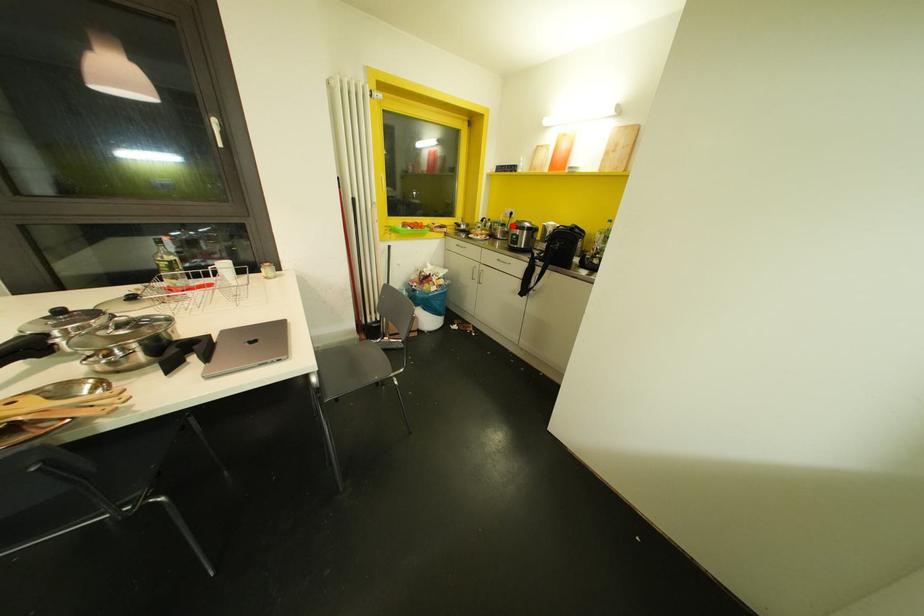
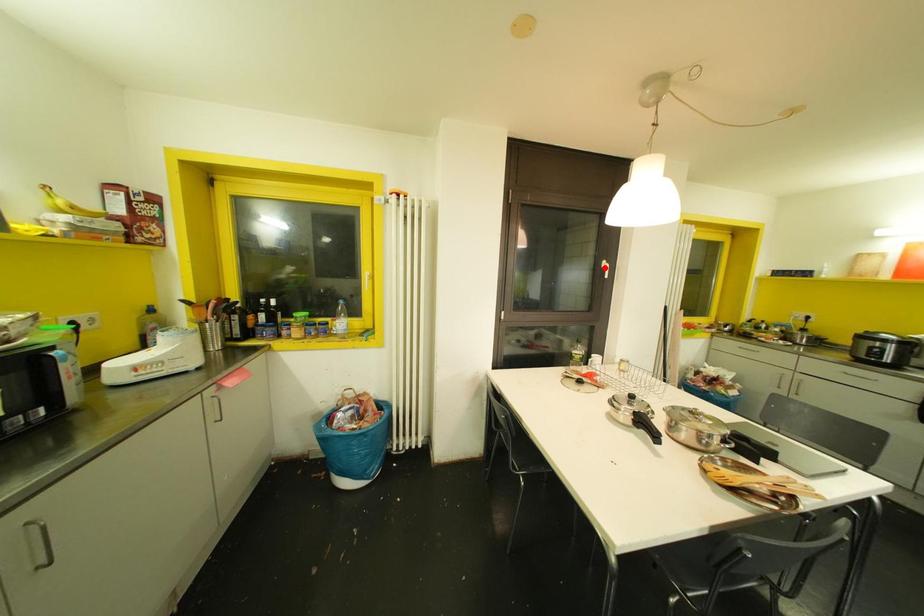
I am providing you with two images of the same scene from different viewpoints. A red point is marked on the first image and another point is marked on the second image. Does the point marked in image1 correspond to the same location as the one in image2?

No